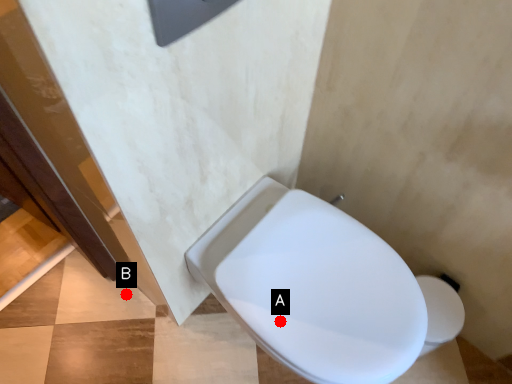
Question: Two points are circled on the image, labeled by A and B beside each circle. Which point is closer to the camera?

Choices:
 (A) A is closer
 (B) B is closer

Answer: (A)